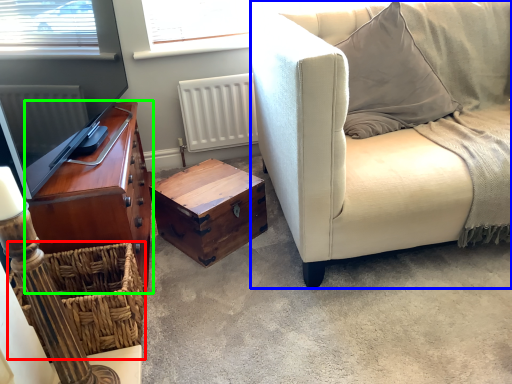
Question: Which object is the closest to the crate (highlighted by a red box)? Choose among these: studio couch (highlighted by a blue box) or cabinetry (highlighted by a green box).

Choices:
 (A) studio couch
 (B) cabinetry

Answer: (B)